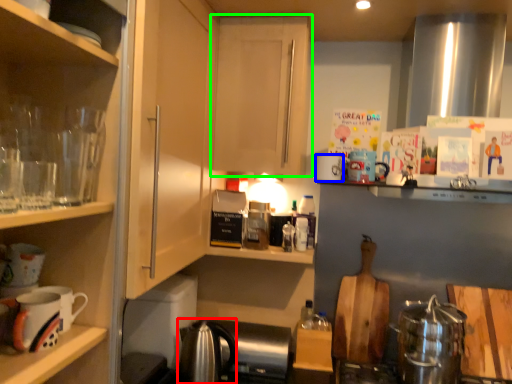
Question: Which object is the closest to the tea pot (highlighted by a red box)? Choose among these: mug (highlighted by a blue box) or cabinetry (highlighted by a green box).

Choices:
 (A) mug
 (B) cabinetry

Answer: (A)